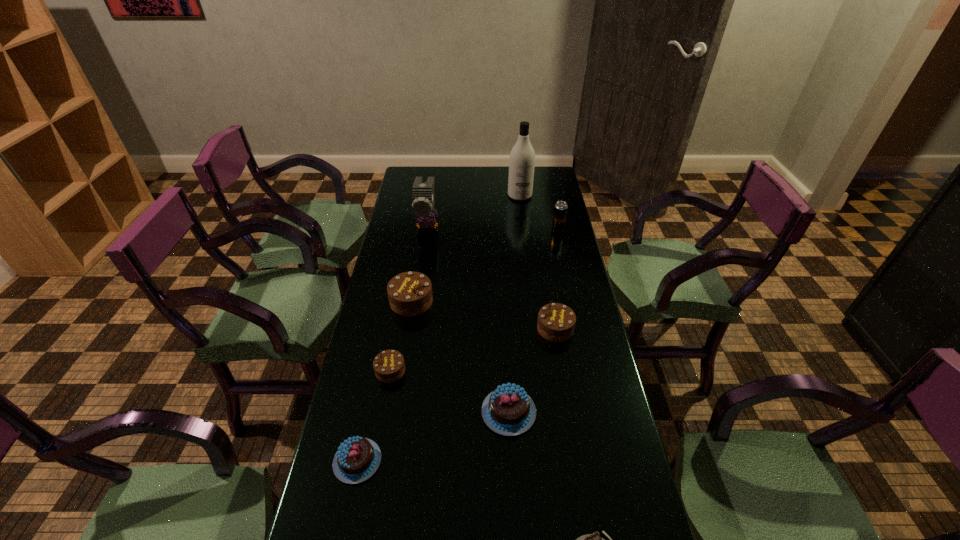
Identify the location of the tallest object. (522, 156).

I want to click on shampoo, so click(x=522, y=156).

Locate an element on the screen. The width and height of the screenshot is (960, 540). bird is located at coordinates pyautogui.click(x=422, y=193).

The height and width of the screenshot is (540, 960). What are the coordinates of `gray bird` in the screenshot? It's located at (422, 193).

Where is `beer can`? beer can is located at coordinates (560, 211).

You are a GUI agent. You are given a task and a screenshot of the screen. Output one action in this format:
    pyautogui.click(x=<x>, y=<y>)
    Task: Click on the tallest chocolate cake
    The image size is (960, 540).
    Given the screenshot: What is the action you would take?
    pyautogui.click(x=410, y=293)

Where is `the second smallest brown chocolate cake`? the second smallest brown chocolate cake is located at coordinates (556, 322).

The width and height of the screenshot is (960, 540). I want to click on the fourth chocolate cake from left to right, so click(508, 410).

Where is `the right pink chocolate cake`? The width and height of the screenshot is (960, 540). the right pink chocolate cake is located at coordinates (508, 410).

Find the location of a particular element. the smallest brown chocolate cake is located at coordinates (389, 366).